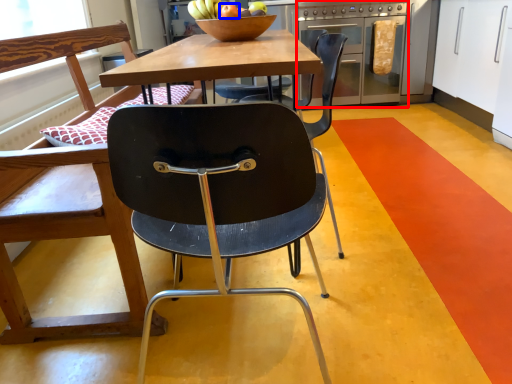
Question: Among these objects, which one is nearest to the camera, oven (highlighted by a red box) or apple (highlighted by a blue box)?

Choices:
 (A) oven
 (B) apple

Answer: (B)